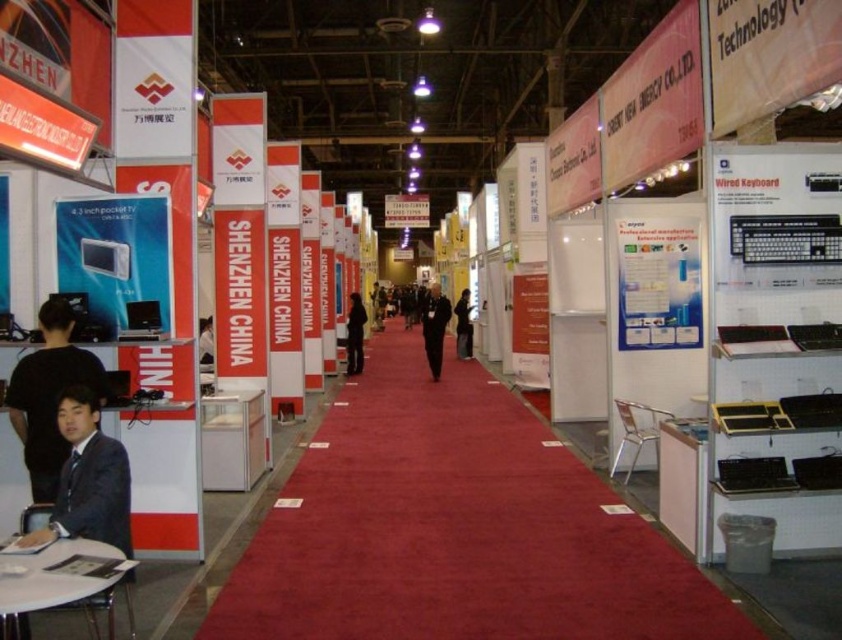
You are an attendee at this exhibition and you want to locate the black matte suit at center. According to the grid coordinates provided, where should you look?

The black matte suit at center is located at point coordinates of (434, 326).

You are a fashion designer observing the exhibition hall. You notice two items at the center of the booth displays. Which one is taller between the black matte suit at center and the black fabric coat at center?

The black matte suit at center is taller than the black fabric coat at center.